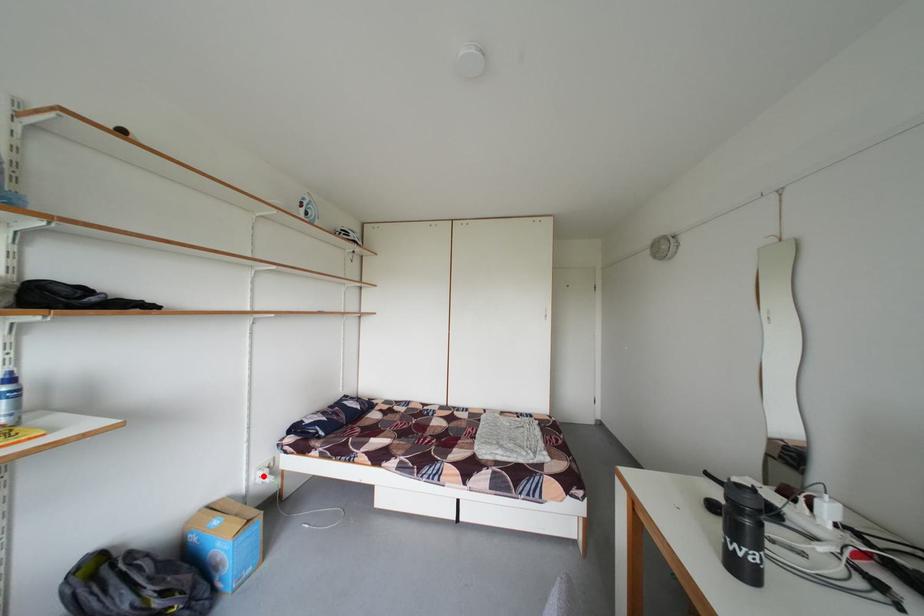
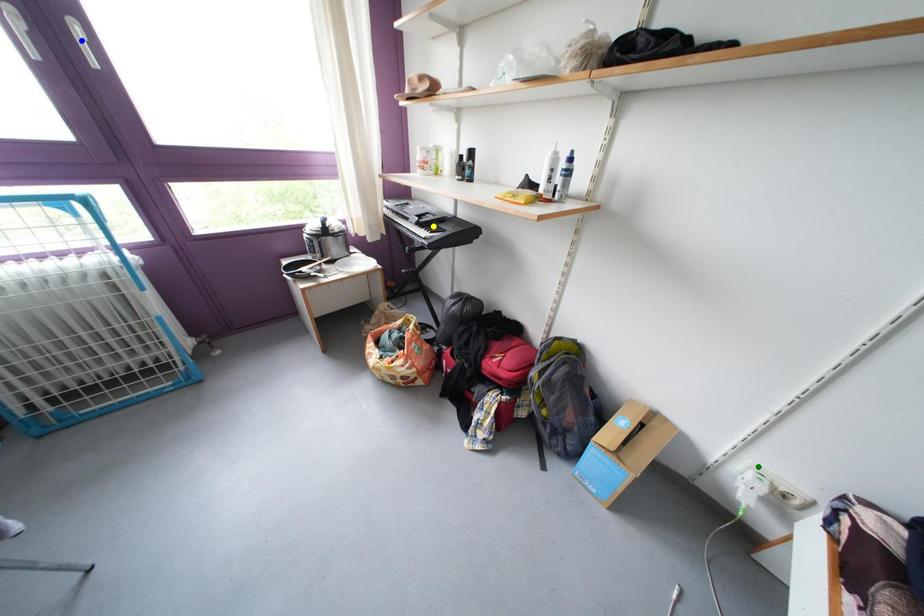
Question: I am providing you with two images of the same scene from different viewpoints. A red point is marked on the first image. You are given multiple points on the second image. Can you choose the point in image 2 that corresponds to the point in image 1?

Choices:
 (A) blue point
 (B) green point
 (C) yellow point

Answer: (B)